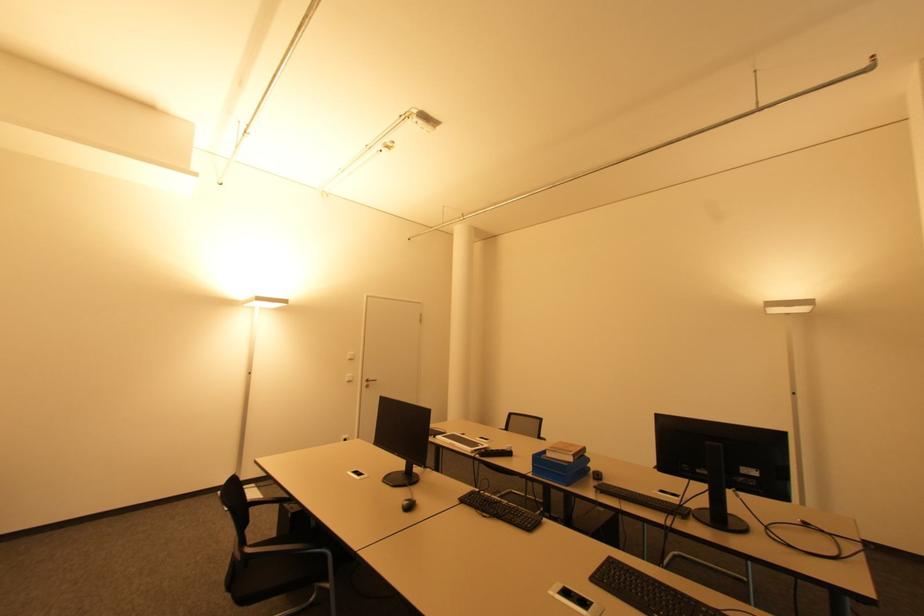
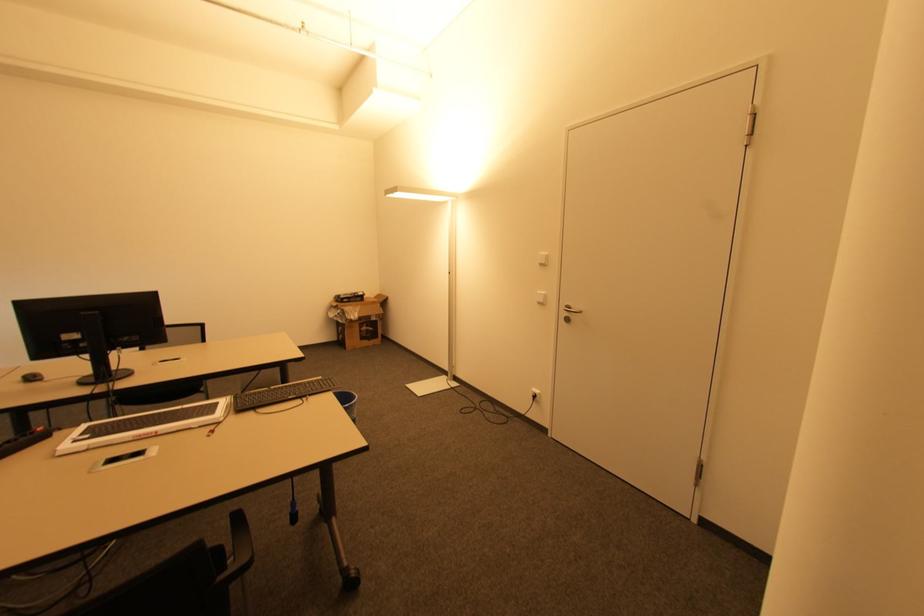
Where in the second image is the point corresponding to [369,387] from the first image?

(568, 320)